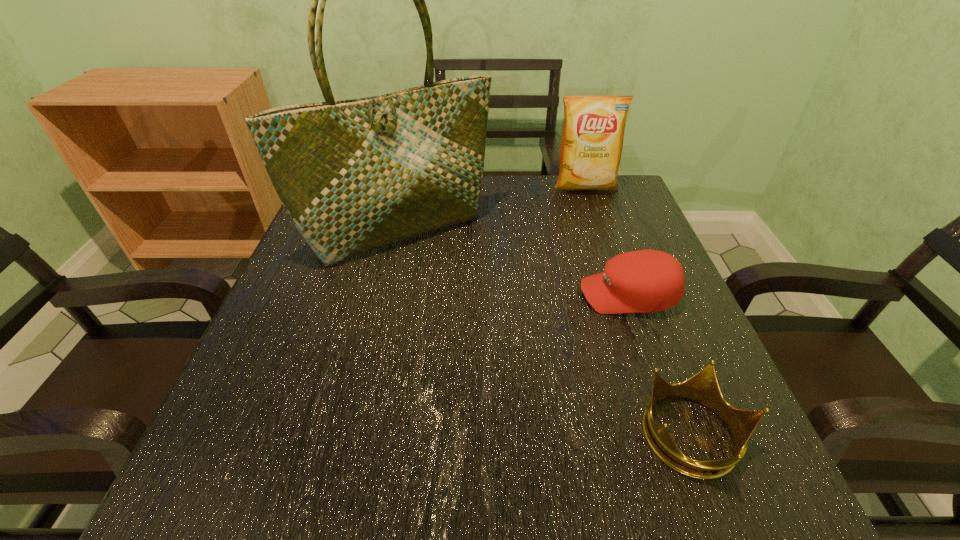
Where is `free space between the second nearest object and the nearest object`? Image resolution: width=960 pixels, height=540 pixels. free space between the second nearest object and the nearest object is located at coordinates (660, 366).

This screenshot has height=540, width=960. Find the location of `free space that is in between the nearest object and the tallest object`. free space that is in between the nearest object and the tallest object is located at coordinates (546, 333).

At what (x,y) coordinates should I click in order to perform the action: click on free spot between the leftmost object and the farthest object. Please return your answer as a coordinate pair (x, y). The image size is (960, 540). Looking at the image, I should click on (492, 208).

The image size is (960, 540). I want to click on empty location between the third shortest object and the cap, so click(x=607, y=241).

Locate an element on the screen. Image resolution: width=960 pixels, height=540 pixels. vacant point located between the second nearest object and the shopping bag is located at coordinates (515, 263).

This screenshot has width=960, height=540. I want to click on object that can be found as the second closest to the third farthest object, so click(355, 175).

Identify the location of object that stands as the third closest to the leftmost object. (703, 387).

Find the location of a particular element. The width and height of the screenshot is (960, 540). free location that satisfies the following two spatial constraints: 1. on the front-facing side of the crown; 2. on the right side of the second nearest object is located at coordinates (679, 436).

Where is `free point that satisfies the following two spatial constraints: 1. on the front side of the crown; 2. on the left side of the leftmost object`? This screenshot has width=960, height=540. free point that satisfies the following two spatial constraints: 1. on the front side of the crown; 2. on the left side of the leftmost object is located at coordinates (353, 436).